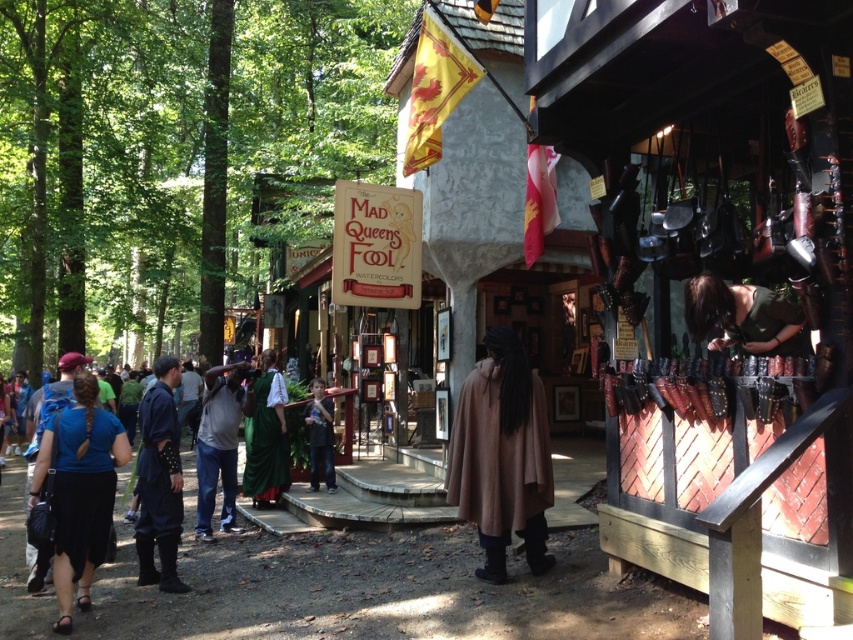
You are a vendor at the medieval event and need to decide which shirt to display first. The blue fabric shirt at lower left and the green matte shirt at upper right are both popular. Which shirt should you choose if you want to show the bigger one first?

The blue fabric shirt at lower left is larger in size than the green matte shirt at upper right, so you should choose the blue fabric shirt at lower left to display first.

You are a tailor at the medieval event and need to decide which shirt to display first. The blue fabric shirt at lower left and the green matte shirt at upper right are both on your list. Based on their sizes, which shirt should you choose to display first if you want to start with the larger one?

The blue fabric shirt at lower left should be displayed first since its width is larger than the green matte shirt at upper right.

You are a tailor at the medieval event and need to determine if the blue cotton shirt at center can fit into a display case that is the same width as the denim pants at center. Can it fit?

The blue cotton shirt at center has a larger width than the denim pants at center, so it cannot fit into the display case designed for the denim pants at center.